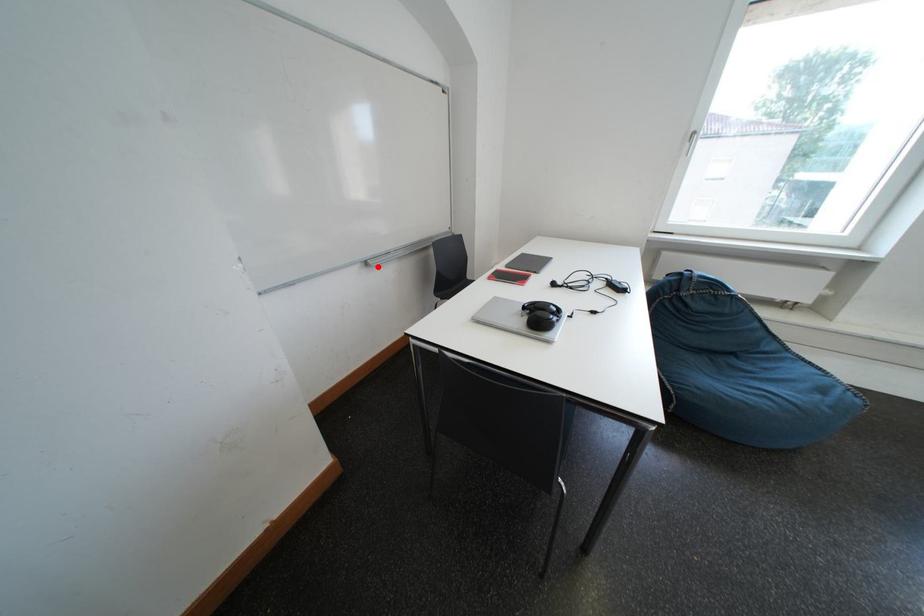
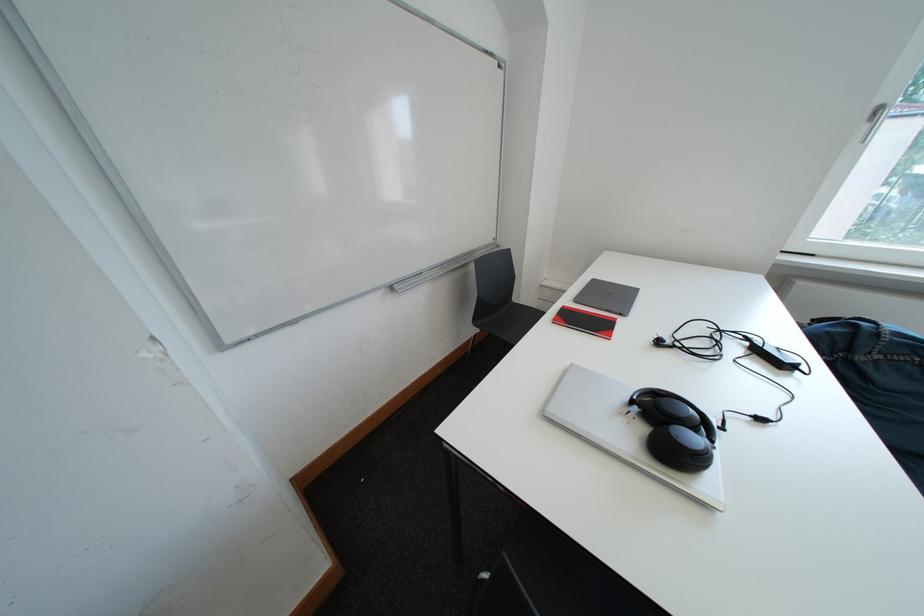
Question: I am providing you with two images of the same scene from different viewpoints. Image1 has a red point marked. In image2, the corresponding 3D location appears at what relative position? Reply with the corresponding letter.

Choices:
 (A) Closer
 (B) Farther

Answer: (B)